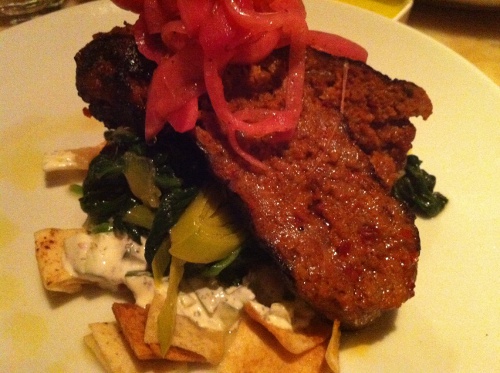
Identify the location of yellow round plate. (452, 286).